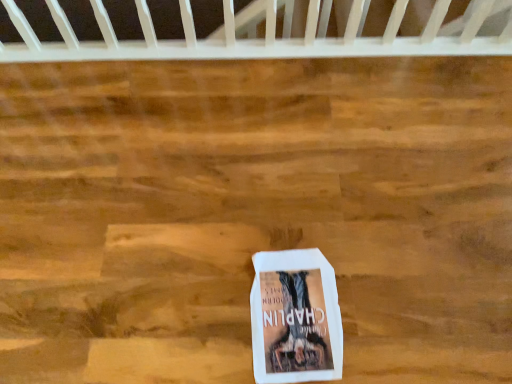
You are a GUI agent. You are given a task and a screenshot of the screen. Output one action in this format:
    pyautogui.click(x=<x>, y=<y>)
    Task: Click on the vacant position to the left of white paper book at center
    
    Given the screenshot: What is the action you would take?
    pyautogui.click(x=201, y=304)